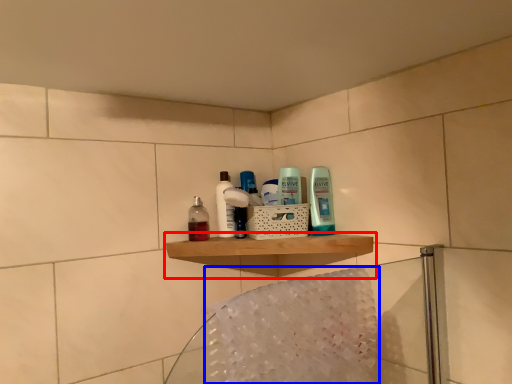
Question: Among these objects, which one is nearest to the camera, shelf (highlighted by a red box) or bath towel (highlighted by a blue box)?

Choices:
 (A) shelf
 (B) bath towel

Answer: (B)